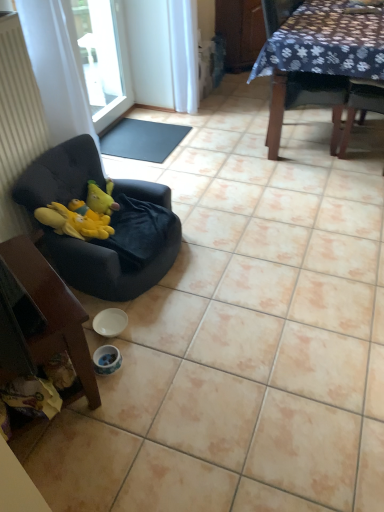
Describe the element at coordinates (99, 54) in the screenshot. I see `transparent glass window at upper left` at that location.

Describe the element at coordinates (107, 267) in the screenshot. I see `velvet black chair at left, marked as the 2th chair in a bottom-to-top arrangement` at that location.

I want to click on white fabric curtain at left, so click(x=57, y=68).

At what (x,y) coordinates should I click in order to perform the action: click on white glossy bowl at lower center. Please return your answer as a coordinate pair (x, y). Looking at the image, I should click on (107, 360).

In order to click on transparent glass window at upper left in this screenshot , I will do `click(99, 54)`.

Is black rubber mat at center in front of or behind dark fabric chair at upper right, which is counted as the third chair, starting from the left, in the image?

Clearly, black rubber mat at center is behind dark fabric chair at upper right, which is counted as the third chair, starting from the left.

From the image's perspective, which is above, black rubber mat at center or dark fabric chair at upper right, marked as the 3th chair in a front-to-back arrangement?

From the image's view, dark fabric chair at upper right, marked as the 3th chair in a front-to-back arrangement, is above.

Who is smaller, black rubber mat at center or dark fabric chair at upper right, the first chair when ordered from back to front?

black rubber mat at center is smaller.

Locate an element on the screen. mat that appears on the right of white fabric curtain at left is located at coordinates (142, 139).

From a real-world perspective, is white fabric curtain at left beneath black rubber mat at center?

No, from a real-world perspective, white fabric curtain at left is not under black rubber mat at center.

Which of these two, white fabric curtain at left or black rubber mat at center, is smaller?

black rubber mat at center.

In terms of width, does white fabric curtain at left look wider or thinner when compared to black rubber mat at center?

Considering their sizes, white fabric curtain at left looks slimmer than black rubber mat at center.

Who is taller, dark fabric chair at upper right, marked as the 3th chair in a front-to-back arrangement, or white fabric curtain at left?

white fabric curtain at left is taller.

Is dark fabric chair at upper right, the 1th chair when ordered from top to bottom, aimed at white fabric curtain at left?

No, dark fabric chair at upper right, the 1th chair when ordered from top to bottom, is not facing towards white fabric curtain at left.

Is dark fabric chair at upper right, which is counted as the third chair, starting from the left, positioned far away from white fabric curtain at left?

Yes, dark fabric chair at upper right, which is counted as the third chair, starting from the left, and white fabric curtain at left are located far from each other.

From the image's perspective, would you say transparent glass window at upper left is positioned over dark fabric chair at upper right, the third chair ordered from the bottom?

Indeed, from the image's perspective, transparent glass window at upper left is shown above dark fabric chair at upper right, the third chair ordered from the bottom.

Considering the positions of objects transparent glass window at upper left and dark fabric chair at upper right, the 1th chair when ordered from top to bottom, in the image provided, who is behind, transparent glass window at upper left or dark fabric chair at upper right, the 1th chair when ordered from top to bottom,?

transparent glass window at upper left is more distant.

Could dark fabric chair at upper right, arranged as the 1th chair when viewed from the right, be considered to be inside transparent glass window at upper left?

That's incorrect, dark fabric chair at upper right, arranged as the 1th chair when viewed from the right, is not inside transparent glass window at upper left.

Does black rubber mat at center have a greater height compared to white glossy bowl at lower center?

In fact, black rubber mat at center may be shorter than white glossy bowl at lower center.

Does point (118, 130) come farther from viewer compared to point (103, 352)?

Yes, point (118, 130) is behind point (103, 352).

Can you confirm if black rubber mat at center is smaller than white glossy bowl at lower center?

No.

Is black rubber mat at center facing towards white glossy bowl at lower center?

No.

Does white fabric curtain at left come behind dark fabric chair at upper right, marked as the 3th chair in a front-to-back arrangement?

No, it is not.

From the picture: Measure the distance from white fabric curtain at left to dark fabric chair at upper right, the first chair when ordered from back to front.

They are 4.67 feet apart.

Can you tell me how much white fabric curtain at left and dark fabric chair at upper right, the third chair ordered from the bottom, differ in facing direction?

The facing directions of white fabric curtain at left and dark fabric chair at upper right, the third chair ordered from the bottom, are 0.84 degrees apart.

The image size is (384, 512). What are the coordinates of `chair lying behind the white fabric curtain at left` in the screenshot? It's located at (309, 102).

From a real-world perspective, between white glossy bowl at lower center and velvet black chair at left, the second chair positioned from the left, who is vertically lower?

In real-world perspective, white glossy bowl at lower center is lower.

Considering their positions, is white glossy bowl at lower center located in front of or behind velvet black chair at left, the 2th chair from the front?

Clearly, white glossy bowl at lower center is behind velvet black chair at left, the 2th chair from the front.

Can you tell me how much white glossy bowl at lower center and velvet black chair at left, the second chair positioned from the left, differ in facing direction?

The facing directions of white glossy bowl at lower center and velvet black chair at left, the second chair positioned from the left, are 46.5 degrees apart.

Considering the relative sizes of white glossy bowl at lower center and velvet black chair at left, the 2th chair in the back-to-front sequence, in the image provided, is white glossy bowl at lower center bigger than velvet black chair at left, the 2th chair in the back-to-front sequence,?

No, white glossy bowl at lower center is not bigger than velvet black chair at left, the 2th chair in the back-to-front sequence.

Locate an element on the screen. This screenshot has height=512, width=384. the 3rd chair positioned above the black rubber mat at center (from a real-world perspective) is located at coordinates (309, 102).

In the image, there is a white fabric curtain at left. Where is `mat below it (from a real-world perspective)`? mat below it (from a real-world perspective) is located at coordinates [142, 139].

Consider the image. Considering their positions, is black rubber mat at center positioned closer to velvet black chair at left, the 2th chair in the back-to-front sequence, than dark fabric chair at upper right, the 1th chair when ordered from top to bottom?

Among the two, black rubber mat at center is located nearer to velvet black chair at left, the 2th chair in the back-to-front sequence.

Which object lies further to the anchor point wooden chair at lower left, the first chair when ordered from front to back, black rubber mat at center or dark fabric chair at upper right, arranged as the 1th chair when viewed from the right?

Among the two, dark fabric chair at upper right, arranged as the 1th chair when viewed from the right, is located further to wooden chair at lower left, the first chair when ordered from front to back.

Looking at the image, which one is located closer to wooden chair at lower left, the first chair when ordered from front to back, velvet black chair at left, the 2th chair in the back-to-front sequence, or transparent glass window at upper left?

velvet black chair at left, the 2th chair in the back-to-front sequence, lies closer to wooden chair at lower left, the first chair when ordered from front to back, than the other object.

Based on their spatial positions, is white glossy bowl at lower center or velvet black chair at left, the 2th chair from the front, closer to dark fabric chair at upper right, which is counted as the third chair, starting from the left?

velvet black chair at left, the 2th chair from the front, is positioned closer to the anchor dark fabric chair at upper right, which is counted as the third chair, starting from the left.

From the image, which object appears to be farther from transparent glass window at upper left, white fabric curtain at left or black rubber mat at center?

Among the two, white fabric curtain at left is located further to transparent glass window at upper left.

When comparing their distances from velvet black chair at left, which is the second chair from top to bottom, does white fabric curtain at left or black rubber mat at center seem further?

black rubber mat at center is further to velvet black chair at left, which is the second chair from top to bottom.

Looking at the image, which one is located further to black rubber mat at center, velvet black chair at left, the second chair when ordered from right to left, or white glossy bowl at lower center?

white glossy bowl at lower center is positioned further to the anchor black rubber mat at center.

Considering their positions, is transparent glass window at upper left positioned closer to dark fabric chair at upper right, which is counted as the third chair, starting from the left, than white glossy bowl at lower center?

The object closer to dark fabric chair at upper right, which is counted as the third chair, starting from the left, is transparent glass window at upper left.

Where is `curtain situated between transparent glass window at upper left and dark fabric chair at upper right, the first chair when ordered from back to front, from left to right`? Image resolution: width=384 pixels, height=512 pixels. curtain situated between transparent glass window at upper left and dark fabric chair at upper right, the first chair when ordered from back to front, from left to right is located at coordinates (57, 68).

Identify the location of chair between white fabric curtain at left and wooden chair at lower left, acting as the third chair starting from the right, vertically. (107, 267).

In order to click on chair between velvet black chair at left, the 2th chair from the front, and black rubber mat at center, along the z-axis in this screenshot , I will do `click(309, 102)`.

In order to click on chair that lies between dark fabric chair at upper right, the first chair when ordered from back to front, and wooden chair at lower left, marked as the first chair in a bottom-to-top arrangement, from top to bottom in this screenshot , I will do `click(107, 267)`.